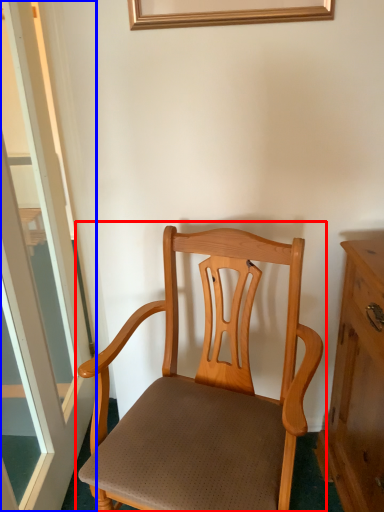
Question: Which object is closer to the camera taking this photo, chair (highlighted by a red box) or window (highlighted by a blue box)?

Choices:
 (A) chair
 (B) window

Answer: (B)